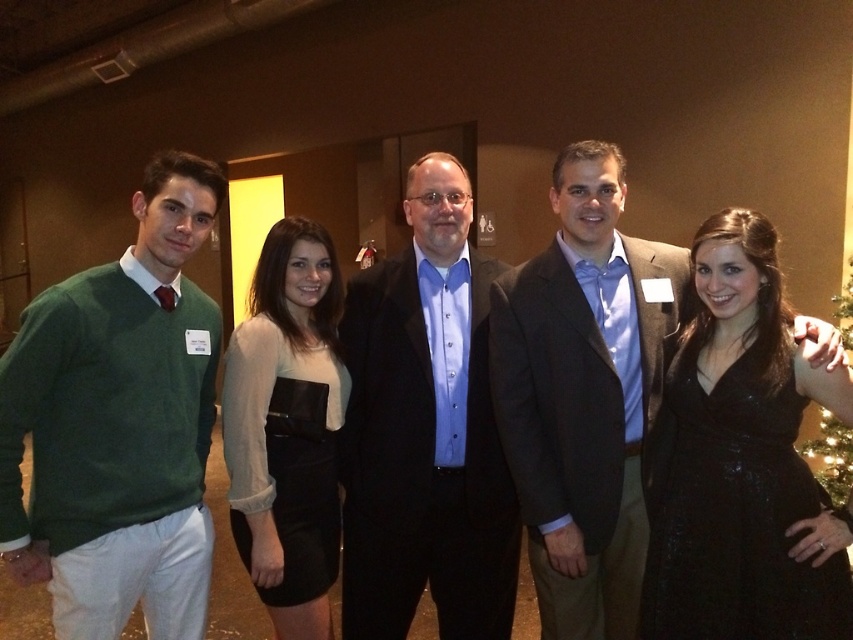
You are taking a photo of two points in the scene. The first point is at coordinates point (x=585, y=442) and the second is at point (x=282, y=512). Which point is closer to the camera?

Point (x=585, y=442) is closer to the camera than point (x=282, y=512).

Consider the image. You are a photographer adjusting the camera settings to ensure all subjects are in focus. The camera has a depth of field that can cover 36 inches. Given the distance between the black satin dress at lower right and the black satin dress at center, will both dresses be in focus?

The black satin dress at lower right and the black satin dress at center are 36.98 inches apart, which exceeds the camera depth of field of 36 inches. Therefore, both dresses cannot be in focus simultaneously.

From the picture: You are a photographer setting up for a group photo. You need to ensure that the black satin dress at lower right and the green artificial christmas tree at right are both visible in the frame. Based on their sizes, which object should you prioritize positioning closer to the camera to avoid being cropped out?

The black satin dress at lower right is wider than the green artificial christmas tree at right, so you should prioritize positioning the black satin dress at lower right closer to the camera to ensure it fits within the frame.